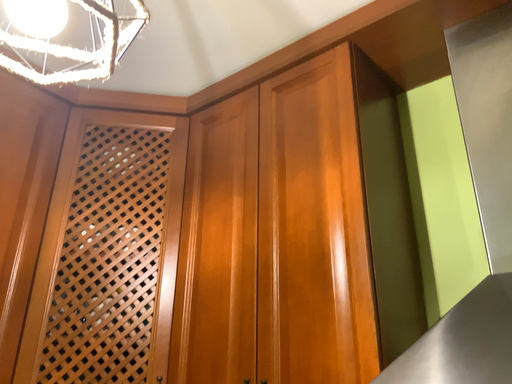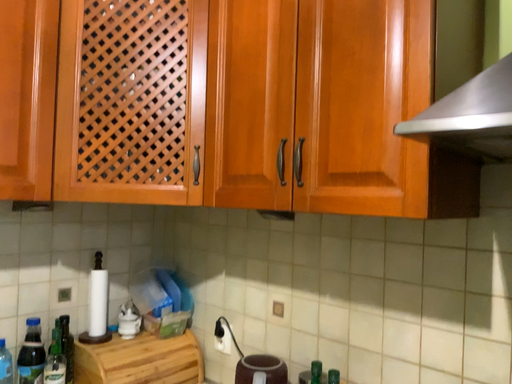
Question: Which way did the camera rotate in the video?

Choices:
 (A) rotated upward
 (B) rotated downward

Answer: (B)